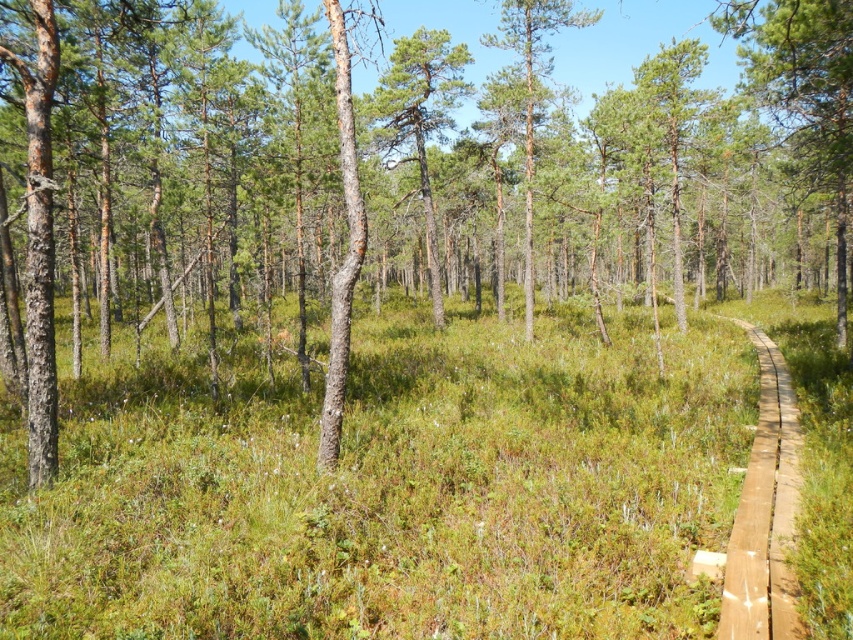
Does green grassy at center have a greater width compared to brown wooden trail at right?

Yes.

Which is below, green grassy at center or brown wooden trail at right?

brown wooden trail at right is lower down.

Identify the location of green grassy at center. The width and height of the screenshot is (853, 640). (392, 490).

Is green grassy at center above green matte tree at center?

No, green grassy at center is not above green matte tree at center.

Is green grassy at center bigger than green matte tree at center?

No.

Find the location of `green grassy at center`. green grassy at center is located at coordinates (392, 490).

Does brown wooden trail at right have a larger size compared to green matte tree at center?

No.

In the scene shown: Can you confirm if brown wooden trail at right is positioned above green matte tree at center?

Incorrect, brown wooden trail at right is not positioned above green matte tree at center.

Is point (759, 378) positioned behind point (381, 97)?

No, it is in front of (381, 97).

Identify the location of brown wooden trail at right. [764, 513].